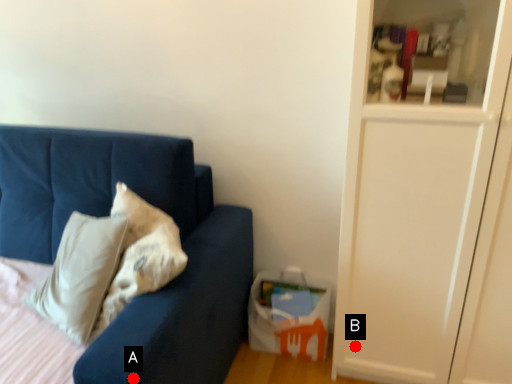
Question: Two points are circled on the image, labeled by A and B beside each circle. Which point is closer to the camera?

Choices:
 (A) A is closer
 (B) B is closer

Answer: (A)